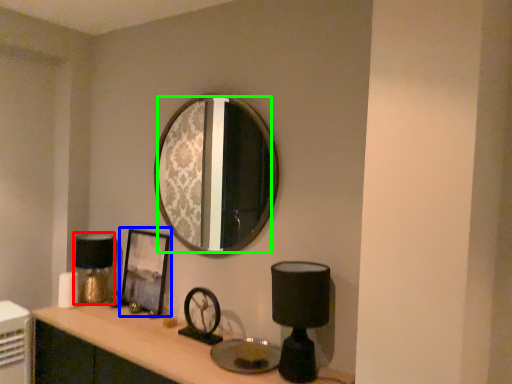
Question: Based on their relative distances, which object is nearer to table lamp (highlighted by a red box)? Choose from picture frame (highlighted by a blue box) and mirror (highlighted by a green box).

Choices:
 (A) picture frame
 (B) mirror

Answer: (A)